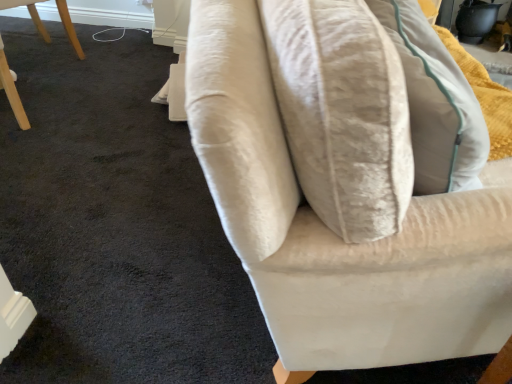
Question: Does velvet beige sofa at center have a larger size compared to matte wood chair at lower left?

Choices:
 (A) no
 (B) yes

Answer: (B)

Question: Is velvet beige sofa at center positioned with its back to matte wood chair at lower left?

Choices:
 (A) no
 (B) yes

Answer: (A)

Question: Can matte wood chair at lower left be found inside velvet beige sofa at center?

Choices:
 (A) yes
 (B) no

Answer: (B)

Question: From a real-world perspective, is velvet beige sofa at center under matte wood chair at lower left?

Choices:
 (A) yes
 (B) no

Answer: (A)

Question: Is velvet beige sofa at center thinner than matte wood chair at lower left?

Choices:
 (A) no
 (B) yes

Answer: (A)

Question: Is velvet beige sofa at center taller than matte wood chair at lower left?

Choices:
 (A) yes
 (B) no

Answer: (B)

Question: Is matte wood chair at lower left to the left of velvet beige sofa at center from the viewer's perspective?

Choices:
 (A) no
 (B) yes

Answer: (B)

Question: Is matte wood chair at lower left in front of velvet beige sofa at center?

Choices:
 (A) no
 (B) yes

Answer: (A)

Question: Can you confirm if matte wood chair at lower left is positioned to the right of velvet beige sofa at center?

Choices:
 (A) no
 (B) yes

Answer: (A)

Question: Can you confirm if matte wood chair at lower left is taller than velvet beige sofa at center?

Choices:
 (A) no
 (B) yes

Answer: (B)

Question: From the image's perspective, is matte wood chair at lower left under velvet beige sofa at center?

Choices:
 (A) no
 (B) yes

Answer: (A)

Question: Are matte wood chair at lower left and velvet beige sofa at center located far from each other?

Choices:
 (A) yes
 (B) no

Answer: (A)

Question: Considering the positions of velvet beige sofa at center and matte wood chair at lower left in the image, is velvet beige sofa at center wider or thinner than matte wood chair at lower left?

Choices:
 (A) thin
 (B) wide

Answer: (B)